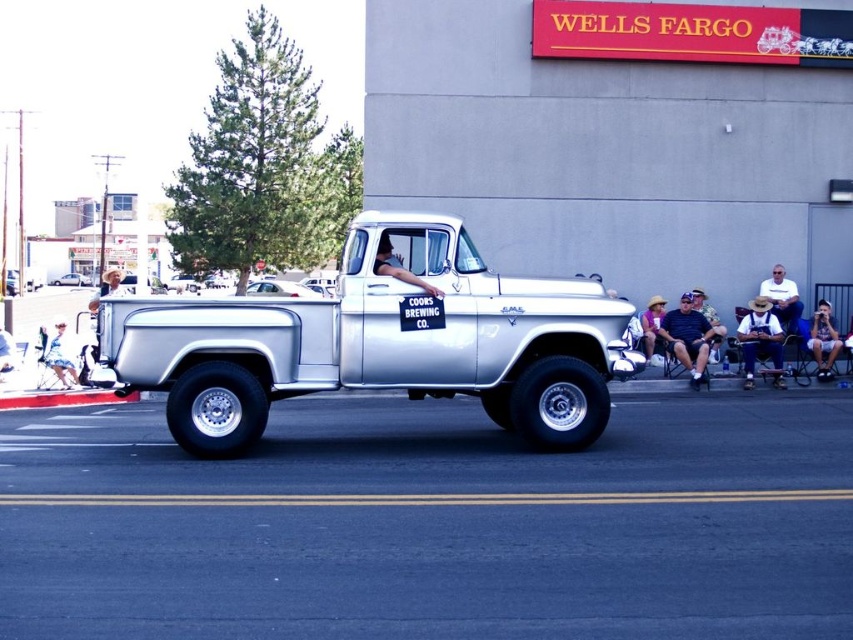
Between dark blue jeans at center and white cotton dress at lower left, which one is positioned higher?

Positioned higher is dark blue jeans at center.

Is dark blue jeans at center to the left of white cotton dress at lower left from the viewer's perspective?

No, dark blue jeans at center is not to the left of white cotton dress at lower left.

Is point (695, 314) positioned after point (55, 369)?

Yes, point (695, 314) is farther from viewer.

Locate an element on the screen. dark blue jeans at center is located at coordinates (688, 337).

Which is more to the right, dark blue jeans at center or purple cotton shirt at center?

Positioned to the right is dark blue jeans at center.

Does point (674, 355) lie in front of point (643, 339)?

That is True.

Who is more distant from viewer, (x=709, y=330) or (x=648, y=358)?

Point (x=709, y=330)

You are a GUI agent. You are given a task and a screenshot of the screen. Output one action in this format:
    pyautogui.click(x=<x>, y=<y>)
    Task: Click on the dark blue jeans at center
    The width and height of the screenshot is (853, 640).
    Given the screenshot: What is the action you would take?
    pyautogui.click(x=688, y=337)

Can you confirm if dark blue jeans at center is shorter than brown corduroy overalls at right?

No.

Which is more to the left, dark blue jeans at center or brown corduroy overalls at right?

Positioned to the left is dark blue jeans at center.

The image size is (853, 640). I want to click on dark blue jeans at center, so click(688, 337).

Where is `dark blue jeans at center`? dark blue jeans at center is located at coordinates (688, 337).